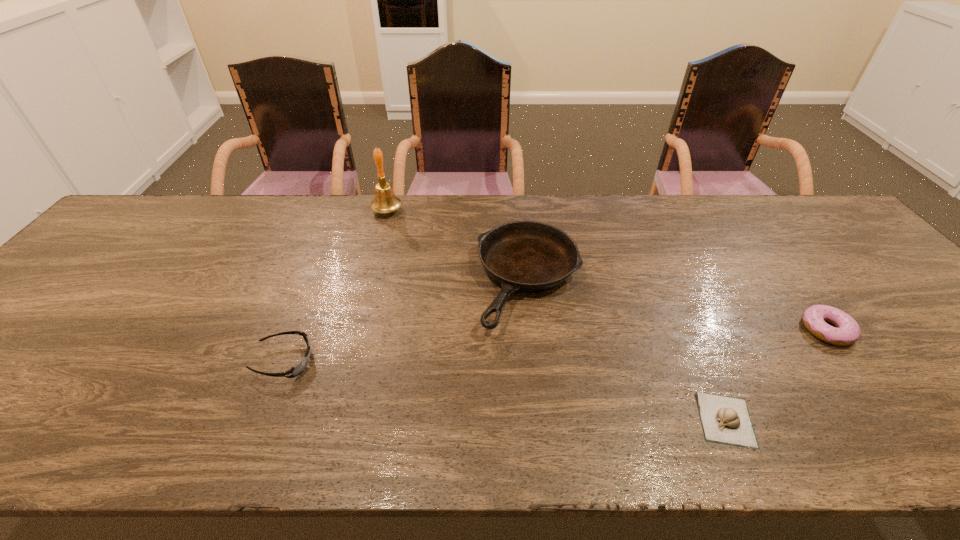
The image size is (960, 540). I want to click on blank area located on the lenses of the sunglasses, so click(x=466, y=361).

Where is `vacant space located 0.120m on the front of the rightmost object`? vacant space located 0.120m on the front of the rightmost object is located at coordinates (876, 394).

The width and height of the screenshot is (960, 540). I want to click on free space located 0.250m on the right of the shortest object, so click(879, 420).

You are a GUI agent. You are given a task and a screenshot of the screen. Output one action in this format:
    pyautogui.click(x=<x>, y=<y>)
    Task: Click on the bell that is at the far edge
    
    Given the screenshot: What is the action you would take?
    pyautogui.click(x=385, y=201)

Find the location of `frying pan at the far edge`. frying pan at the far edge is located at coordinates (522, 256).

Where is `object positioned at the near edge`? object positioned at the near edge is located at coordinates (726, 420).

In order to click on vacant position at the far edge of the desktop in this screenshot , I will do `click(745, 224)`.

This screenshot has height=540, width=960. I want to click on vacant region at the near edge of the desktop, so click(x=286, y=436).

At what (x,y) coordinates should I click in order to perform the action: click on vacant area at the left edge. Please return your answer as a coordinate pair (x, y). Looking at the image, I should click on (115, 252).

You are a GUI agent. You are given a task and a screenshot of the screen. Output one action in this format:
    pyautogui.click(x=<x>, y=<y>)
    Task: Click on the blank space at the right edge
    This screenshot has width=960, height=540.
    Given the screenshot: What is the action you would take?
    pyautogui.click(x=929, y=347)